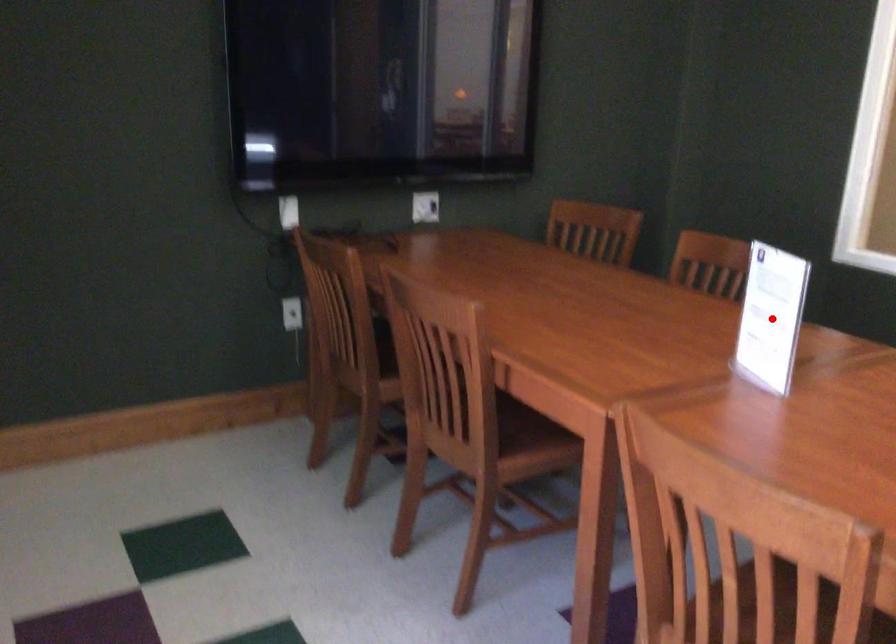
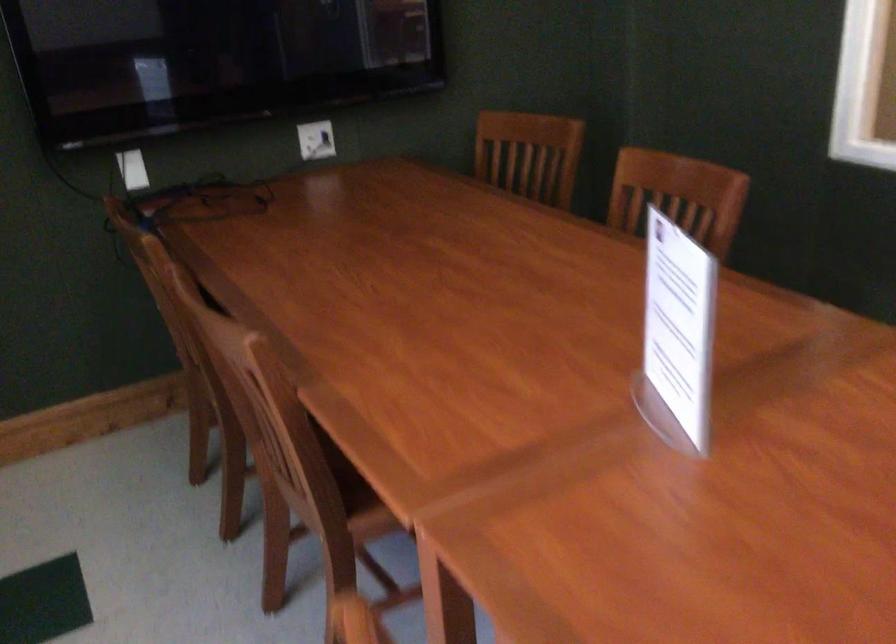
In the second image, find the point that corresponds to the highlighted location in the first image.

(677, 335)